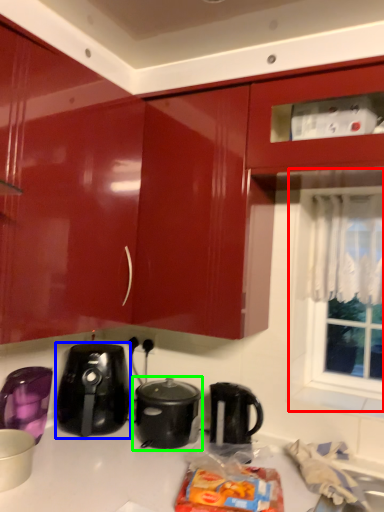
Question: Considering the real-world distances, which object is closest to window (highlighted by a red box)? home appliance (highlighted by a blue box) or slow cooker (highlighted by a green box).

Choices:
 (A) home appliance
 (B) slow cooker

Answer: (B)